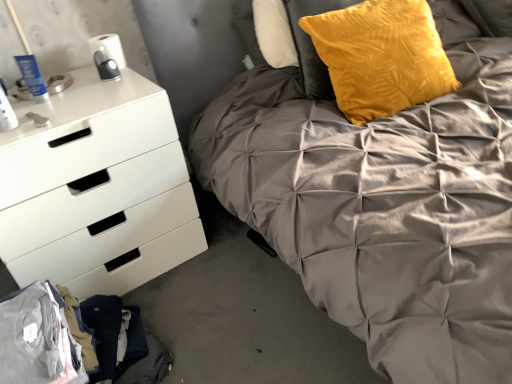
The image size is (512, 384). I want to click on velvet yellow pillow at upper right, so click(381, 57).

Can you confirm if matte gray quilted bed at center is thinner than velvet yellow pillow at upper right?

No, matte gray quilted bed at center is not thinner than velvet yellow pillow at upper right.

From a real-world perspective, is matte gray quilted bed at center physically located above or below velvet yellow pillow at upper right?

From a real-world perspective, matte gray quilted bed at center is physically below velvet yellow pillow at upper right.

Which is correct: matte gray quilted bed at center is inside velvet yellow pillow at upper right, or outside of it?

matte gray quilted bed at center is outside velvet yellow pillow at upper right.

Considering the relative sizes of matte gray quilted bed at center and velvet yellow pillow at upper right in the image provided, is matte gray quilted bed at center shorter than velvet yellow pillow at upper right?

No.

Is white matte chest of drawers at left inside matte gray quilted bed at center?

No, white matte chest of drawers at left is not a part of matte gray quilted bed at center.

Is matte gray quilted bed at center to the right of white matte chest of drawers at left from the viewer's perspective?

Yes, matte gray quilted bed at center is to the right of white matte chest of drawers at left.

From a real-world perspective, which is physically below, matte gray quilted bed at center or white matte chest of drawers at left?

white matte chest of drawers at left is physically lower.

Is matte gray quilted bed at center completely or partially inside velvet yellow pillow at upper right?

That's incorrect, matte gray quilted bed at center is not inside velvet yellow pillow at upper right.

Considering their positions, is velvet yellow pillow at upper right located in front of or behind matte gray quilted bed at center?

Visually, velvet yellow pillow at upper right is located behind matte gray quilted bed at center.

Does point (346, 108) come in front of point (482, 142)?

No, it is behind (482, 142).

From a real-world perspective, which is physically below, velvet yellow pillow at upper right or matte gray quilted bed at center?

matte gray quilted bed at center is physically lower.

Is velvet yellow pillow at upper right oriented towards white matte chest of drawers at left?

No.

Consider the image. Is velvet yellow pillow at upper right next to white matte chest of drawers at left?

No, velvet yellow pillow at upper right is not beside white matte chest of drawers at left.

From the image's perspective, between velvet yellow pillow at upper right and white matte chest of drawers at left, who is located below?

white matte chest of drawers at left, from the image's perspective.

Which of these two, white matte chest of drawers at left or matte gray quilted bed at center, stands shorter?

With less height is white matte chest of drawers at left.

Looking at this image, which object is closer to the camera taking this photo, white matte chest of drawers at left or matte gray quilted bed at center?

matte gray quilted bed at center is closer to the camera.

Does point (22, 286) appear closer or farther from the camera than point (467, 239)?

Clearly, point (22, 286) is more distant from the camera than point (467, 239).

Between white matte chest of drawers at left and matte gray quilted bed at center, which one has larger size?

matte gray quilted bed at center.

Which of these two, white matte chest of drawers at left or velvet yellow pillow at upper right, is smaller?

velvet yellow pillow at upper right is smaller.

Which object is thinner, white matte chest of drawers at left or velvet yellow pillow at upper right?

velvet yellow pillow at upper right.

From a real-world perspective, who is located lower, white matte chest of drawers at left or velvet yellow pillow at upper right?

From a 3D spatial view, white matte chest of drawers at left is below.

Is white matte chest of drawers at left in front of or behind velvet yellow pillow at upper right in the image?

white matte chest of drawers at left is positioned closer to the viewer than velvet yellow pillow at upper right.

In the image, there is a matte gray quilted bed at center. Identify the location of pillow above it (from the image's perspective). (381, 57).

Locate an element on the screen. The image size is (512, 384). bed in front of the white matte chest of drawers at left is located at coordinates (384, 197).

From the image, which object appears to be farther from white matte chest of drawers at left, matte gray quilted bed at center or velvet yellow pillow at upper right?

velvet yellow pillow at upper right lies further to white matte chest of drawers at left than the other object.

In the scene shown: Considering their positions, is matte gray quilted bed at center positioned closer to velvet yellow pillow at upper right than white matte chest of drawers at left?

matte gray quilted bed at center.

When comparing their distances from matte gray quilted bed at center, does white matte chest of drawers at left or velvet yellow pillow at upper right seem closer?

The object closer to matte gray quilted bed at center is velvet yellow pillow at upper right.

Which object lies further to the anchor point matte gray quilted bed at center, velvet yellow pillow at upper right or white matte chest of drawers at left?

white matte chest of drawers at left.

When comparing their distances from velvet yellow pillow at upper right, does white matte chest of drawers at left or matte gray quilted bed at center seem closer?

matte gray quilted bed at center is positioned closer to the anchor velvet yellow pillow at upper right.

When comparing their distances from white matte chest of drawers at left, does velvet yellow pillow at upper right or matte gray quilted bed at center seem closer?

Among the two, matte gray quilted bed at center is located nearer to white matte chest of drawers at left.

The height and width of the screenshot is (384, 512). Find the location of `pillow situated between white matte chest of drawers at left and matte gray quilted bed at center from left to right`. pillow situated between white matte chest of drawers at left and matte gray quilted bed at center from left to right is located at coordinates (381, 57).